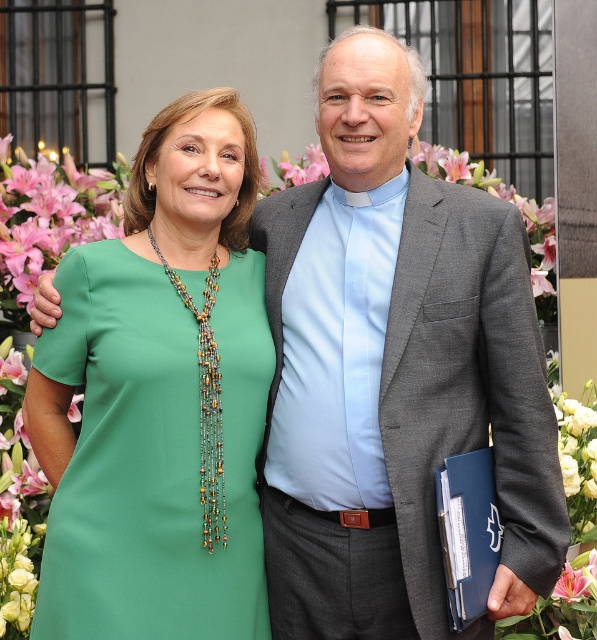
Question: Can you confirm if green fabric dress at center is smaller than blue leather folder at right?

Choices:
 (A) yes
 (B) no

Answer: (B)

Question: Is green fabric dress at center above blue leather folder at right?

Choices:
 (A) no
 (B) yes

Answer: (B)

Question: Among these objects, which one is nearest to the camera?

Choices:
 (A) green fabric dress at center
 (B) blue leather folder at right

Answer: (A)

Question: Can you confirm if green fabric dress at center is thinner than blue leather folder at right?

Choices:
 (A) no
 (B) yes

Answer: (A)

Question: Among these points, which one is nearest to the camera?

Choices:
 (A) (487, 568)
 (B) (109, 410)

Answer: (B)